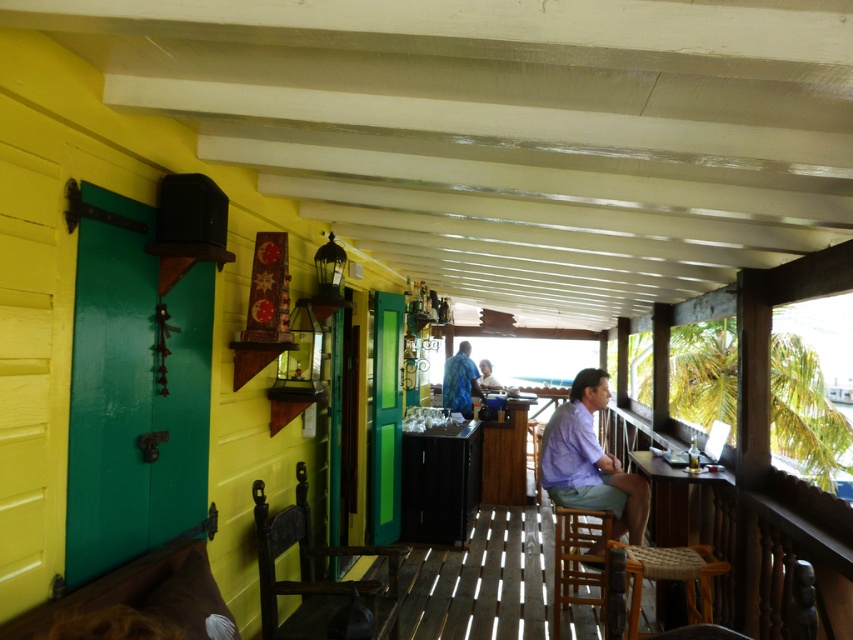
Does blue fabric shirt at center have a larger size compared to light brown wooden chair at center?

Indeed, blue fabric shirt at center has a larger size compared to light brown wooden chair at center.

Can you confirm if blue fabric shirt at center is smaller than light brown wooden chair at center?

No.

The width and height of the screenshot is (853, 640). I want to click on blue fabric shirt at center, so click(460, 381).

Between wooden chair at left and light brown wooden chair at center, which one appears on the right side from the viewer's perspective?

light brown wooden chair at center

Consider the image. Which of these two, wooden chair at left or light brown wooden chair at center, stands shorter?

With less height is light brown wooden chair at center.

Does point (306, 536) come behind point (492, 381)?

No, it is in front of (492, 381).

What are the coordinates of `wooden chair at left` in the screenshot? It's located at (312, 572).

Which is above, wooden chair at left or wooden stool at lower right?

Positioned higher is wooden chair at left.

Can you confirm if wooden chair at left is positioned to the left of wooden stool at lower right?

Indeed, wooden chair at left is positioned on the left side of wooden stool at lower right.

Is point (268, 605) positioned before point (564, 573)?

Yes, point (268, 605) is closer to viewer.

Image resolution: width=853 pixels, height=640 pixels. What are the coordinates of `wooden chair at left` in the screenshot? It's located at (312, 572).